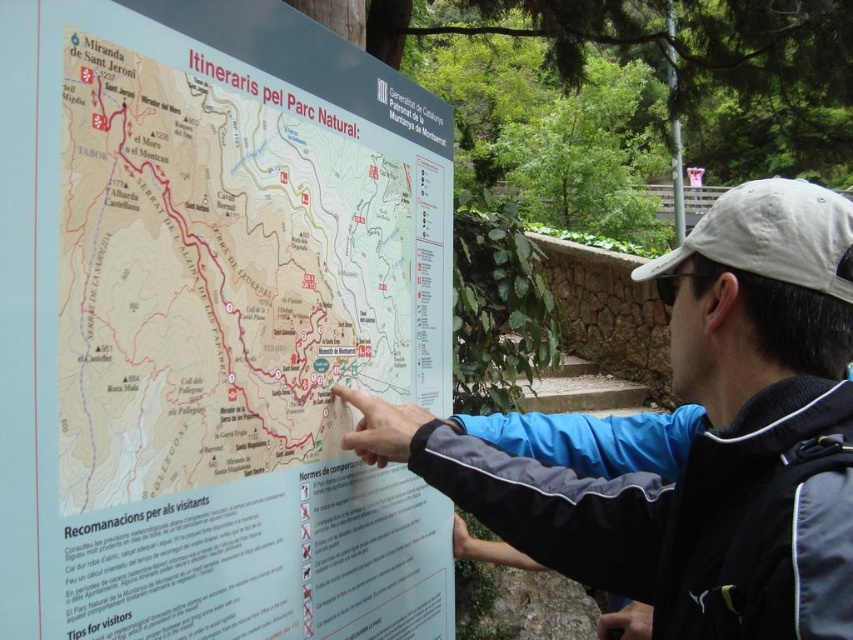
You are a hiker planning to follow the trail indicated by the light blue plastic sign at center and the blue fabric jacket at center. Since you need to know which item is narrower to decide your path, can you determine which one is narrower?

The light blue plastic sign at center is narrower than the blue fabric jacket at center because its width is less than the jacket.

You are standing at the point where the man is pointing on the map. You want to place a new light blue plastic sign at center. According to the map, what are the coordinates where you should place it?

The light blue plastic sign at center should be placed at coordinates point (x=213, y=324) as stated in the map description.

You are a hiker who needs to read the information on the light blue plastic sign at center and the blue fabric jacket at center. Which object is positioned to the left of the other?

The light blue plastic sign at center is to the left of the blue fabric jacket at center.